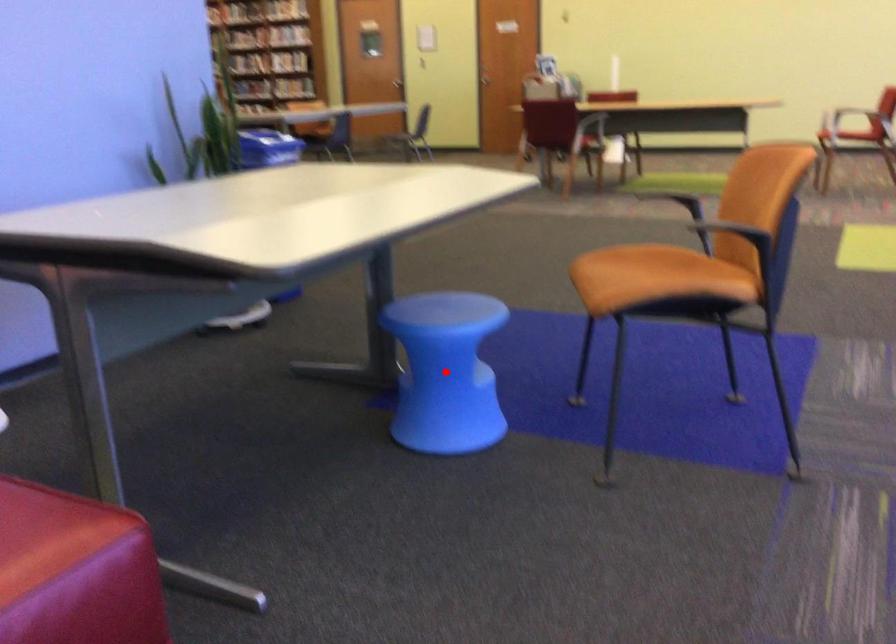
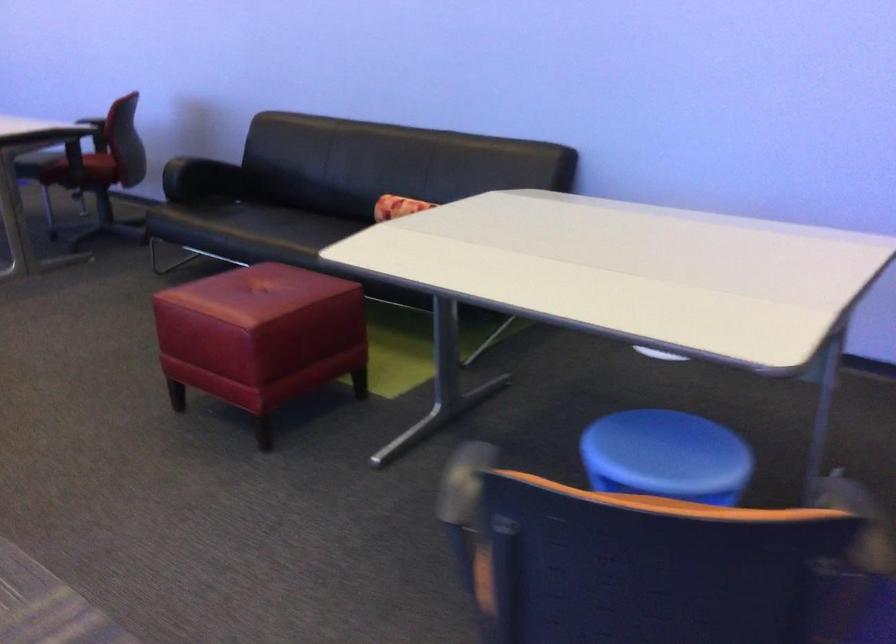
Question: I am providing you with two images of the same scene from different viewpoints. A red point is marked on the first image. At the location where the point appears in image 1, is it still visible in image 2?

Choices:
 (A) Yes
 (B) No

Answer: (B)